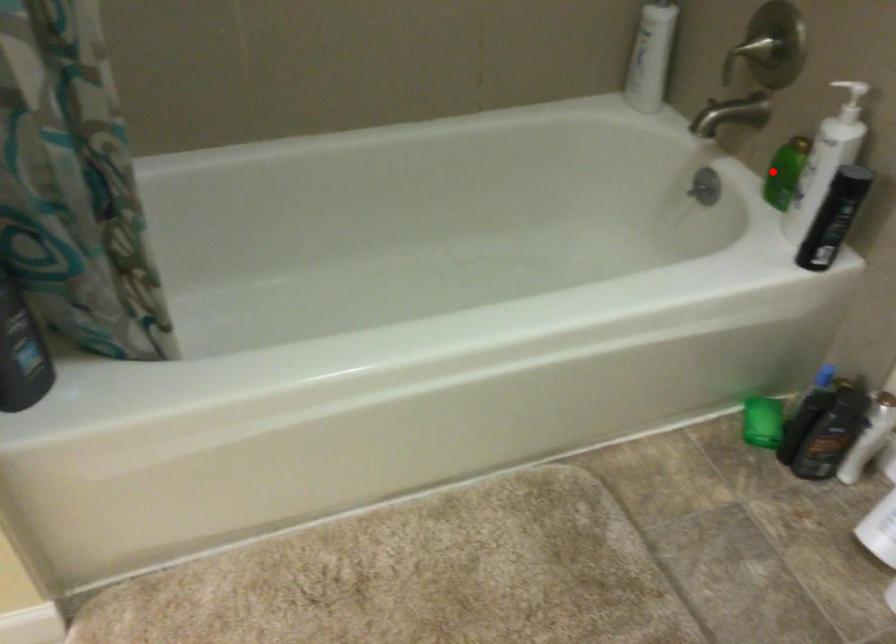
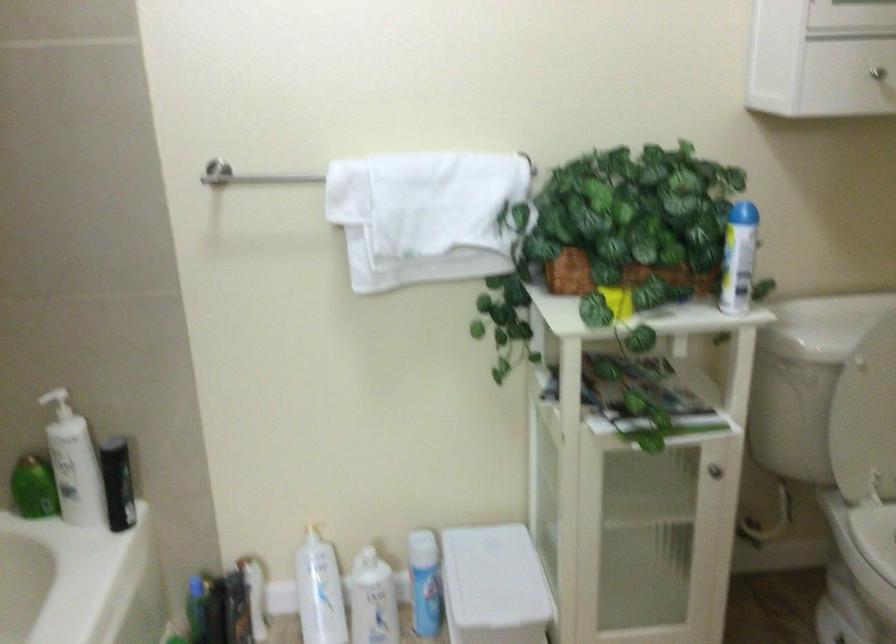
The point at the highlighted location is marked in the first image. Where is the corresponding point in the second image?

(33, 488)